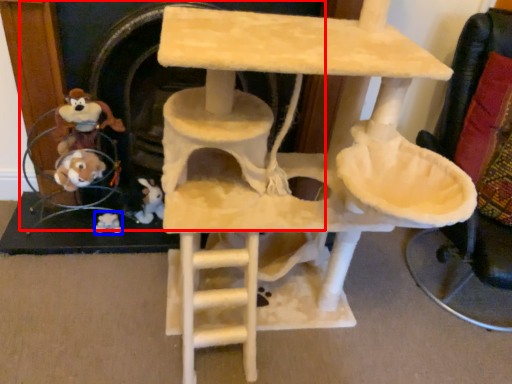
Question: Which object appears farthest to the camera in this image, fireplace (highlighted by a red box) or toy (highlighted by a blue box)?

Choices:
 (A) fireplace
 (B) toy

Answer: (B)